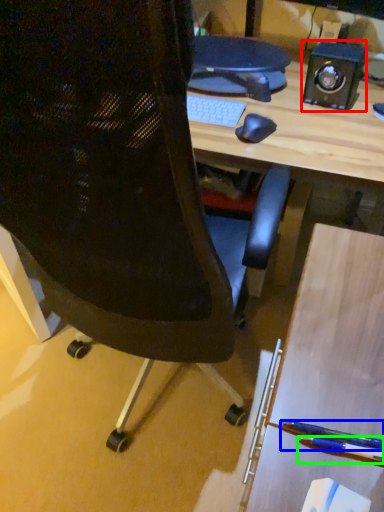
Question: Which object is positioned farthest from speaker (highlighted by a red box)? Select from penguin (highlighted by a blue box) and pencil (highlighted by a green box).

Choices:
 (A) penguin
 (B) pencil

Answer: (B)